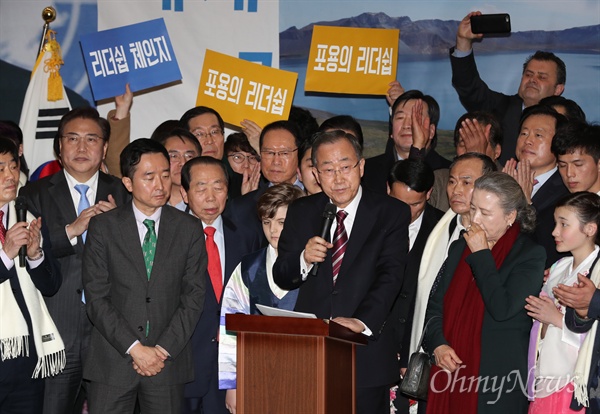
The width and height of the screenshot is (600, 414). Find the location of `phone`. phone is located at coordinates (495, 27).